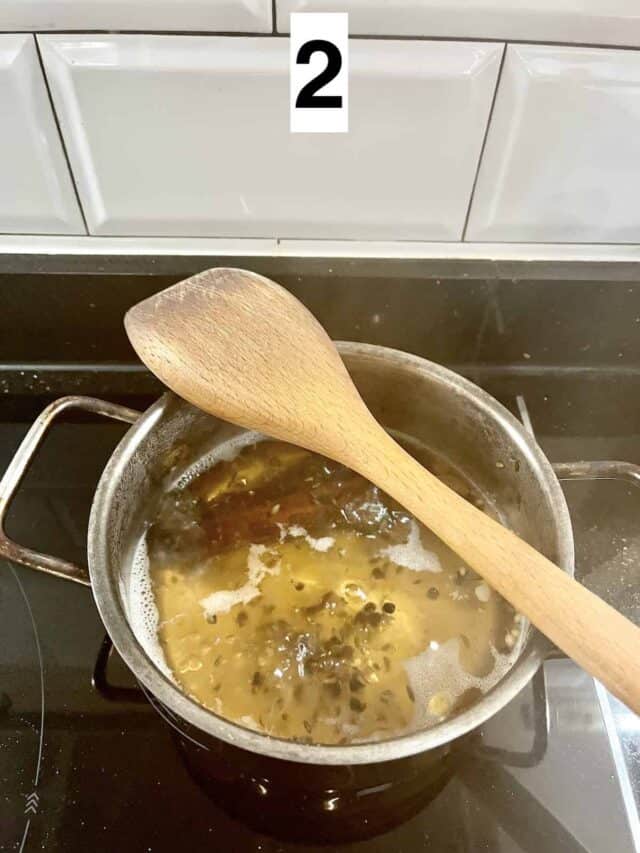
This screenshot has width=640, height=853. Find the location of `silver pot, metal`. silver pot, metal is located at coordinates (111, 489).